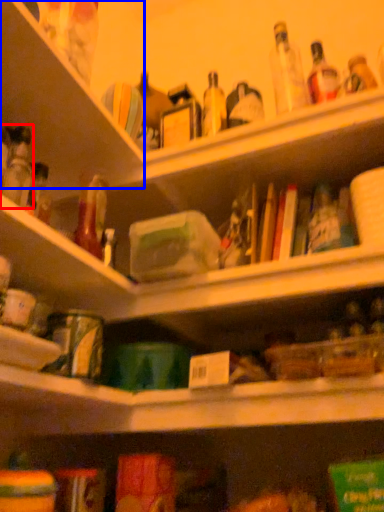
Question: Which of the following is the farthest to the observer, bottle (highlighted by a red box) or shelf (highlighted by a blue box)?

Choices:
 (A) bottle
 (B) shelf

Answer: (B)